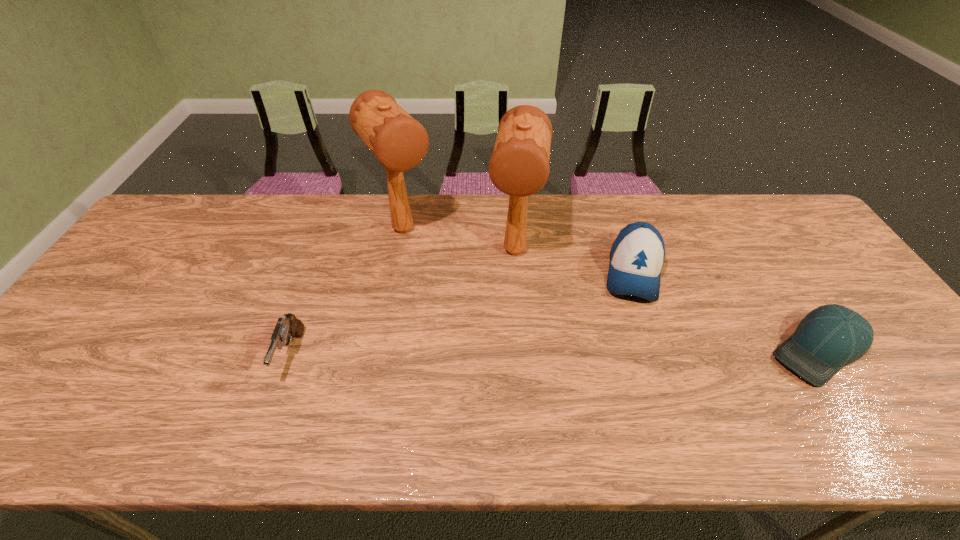
Find the location of a particular element. This screenshot has width=960, height=540. vacant area that satisfies the following two spatial constraints: 1. on the front side of the rightmost object; 2. on the right side of the farther baseball cap is located at coordinates (659, 350).